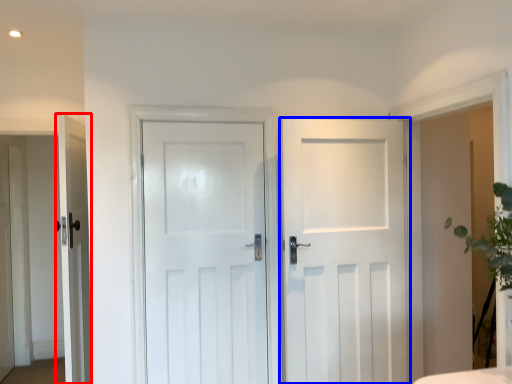
Question: Which point is further to the camera, door (highlighted by a red box) or door (highlighted by a blue box)?

Choices:
 (A) door
 (B) door

Answer: (A)